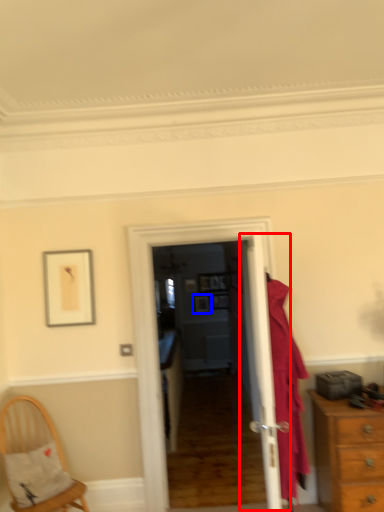
Question: Which object appears closest to the camera in this image, door (highlighted by a red box) or picture frame (highlighted by a blue box)?

Choices:
 (A) door
 (B) picture frame

Answer: (A)